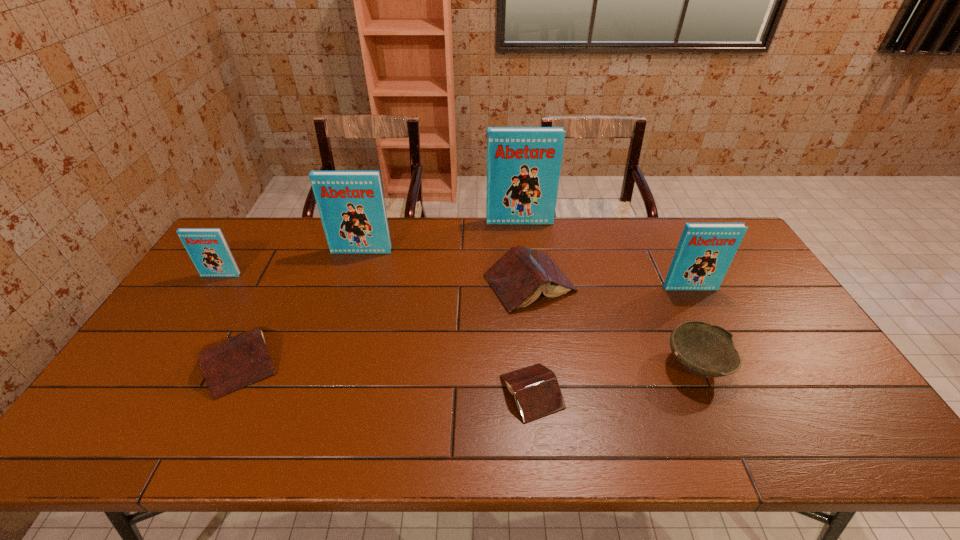
At what (x,y) coordinates should I click in order to perform the action: click on vacant area that satisfies the following two spatial constraints: 1. on the front cover of the second biggest blue book; 2. on the right side of the farthest brown book. Please return your answer as a coordinate pair (x, y). Image resolution: width=960 pixels, height=540 pixels. Looking at the image, I should click on (351, 284).

Identify the location of free spot that satisfies the following two spatial constraints: 1. on the front cover of the biggest brown book; 2. on the right side of the leftmost blue book. (216, 284).